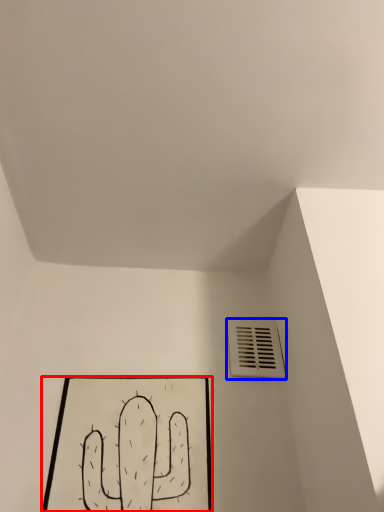
Question: Among these objects, which one is farthest to the camera, picture frame (highlighted by a red box) or air conditioning (highlighted by a blue box)?

Choices:
 (A) picture frame
 (B) air conditioning

Answer: (B)